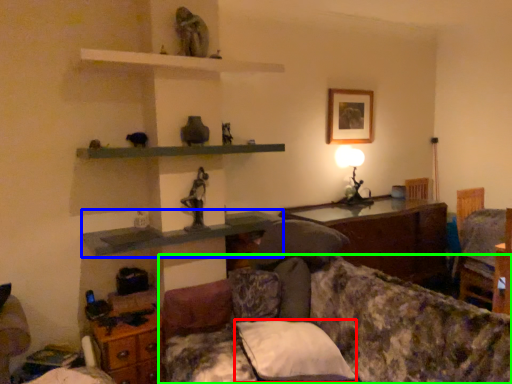
Question: Estimate the real-world distances between objects in this image. Which object is farther from pillow (highlighted by a red box), shelf (highlighted by a blue box) or studio couch (highlighted by a green box)?

Choices:
 (A) shelf
 (B) studio couch

Answer: (A)